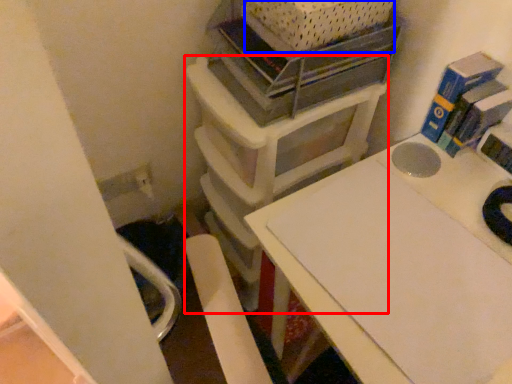
Question: Which of the following is the farthest to the observer, furniture (highlighted by a red box) or crate (highlighted by a blue box)?

Choices:
 (A) furniture
 (B) crate

Answer: (A)